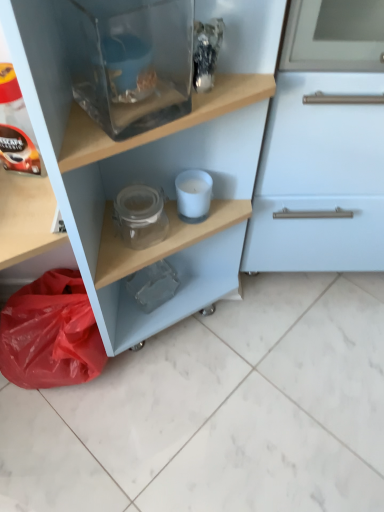
The width and height of the screenshot is (384, 512). What are the coordinates of `unoccupied region to the right of red plastic bag at lower left` in the screenshot? It's located at (165, 373).